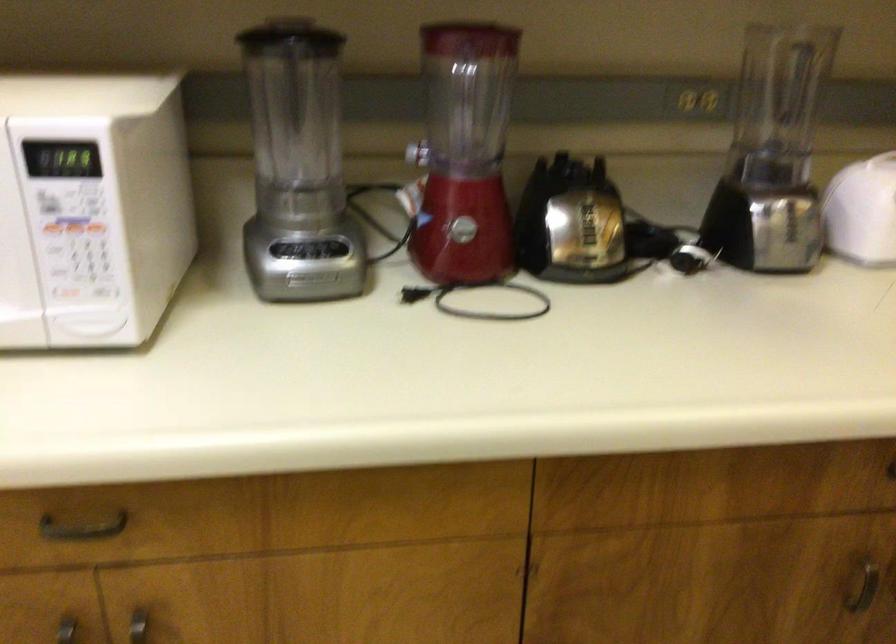
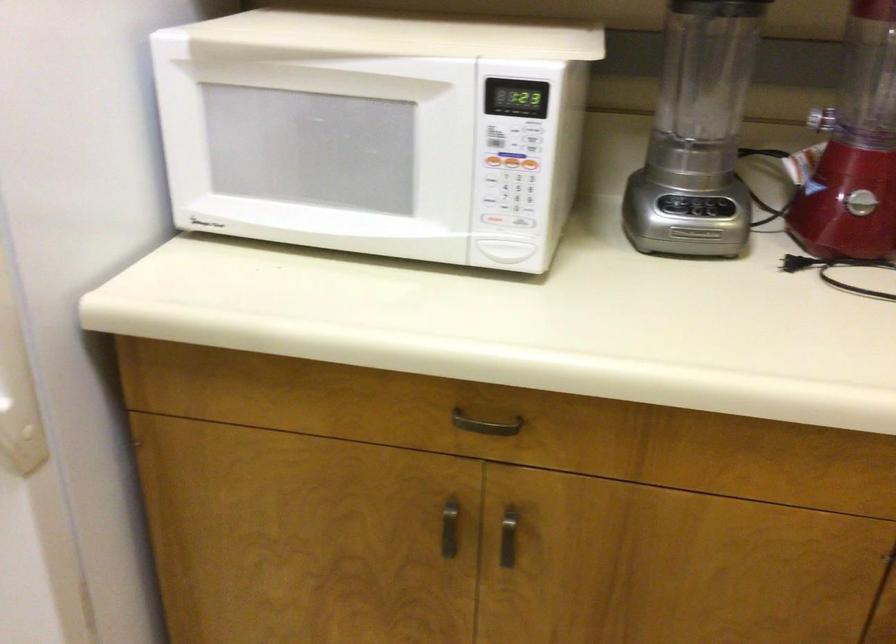
What movement of the cameraman would produce the second image?

The cameraman walked toward left, backward.